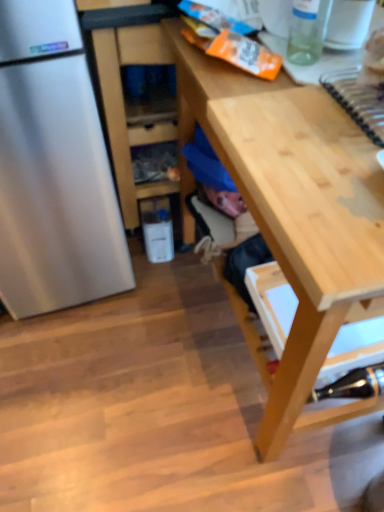
Question: From a real-world perspective, is light wood desk at center positioned above or below metallic silver stapler at lower right, which appears as the second bottle when viewed from the top?

Choices:
 (A) below
 (B) above

Answer: (B)

Question: In terms of height, does light wood desk at center look taller or shorter compared to metallic silver stapler at lower right, which appears as the second bottle when viewed from the top?

Choices:
 (A) short
 (B) tall

Answer: (B)

Question: Which object is the farthest from the wooden cabinet at center?

Choices:
 (A) transparent glass bottle at upper right, the 2th bottle positioned from the bottom
 (B) light wood desk at center
 (C) metallic silver stapler at lower right, which is counted as the 1th bottle, starting from the back

Answer: (C)

Question: Which of these objects is positioned closest to the transparent glass bottle at upper right, which ranks as the first bottle in top-to-bottom order?

Choices:
 (A) light wood desk at center
 (B) metallic silver stapler at lower right, which appears as the second bottle when viewed from the top
 (C) wooden cabinet at center

Answer: (A)